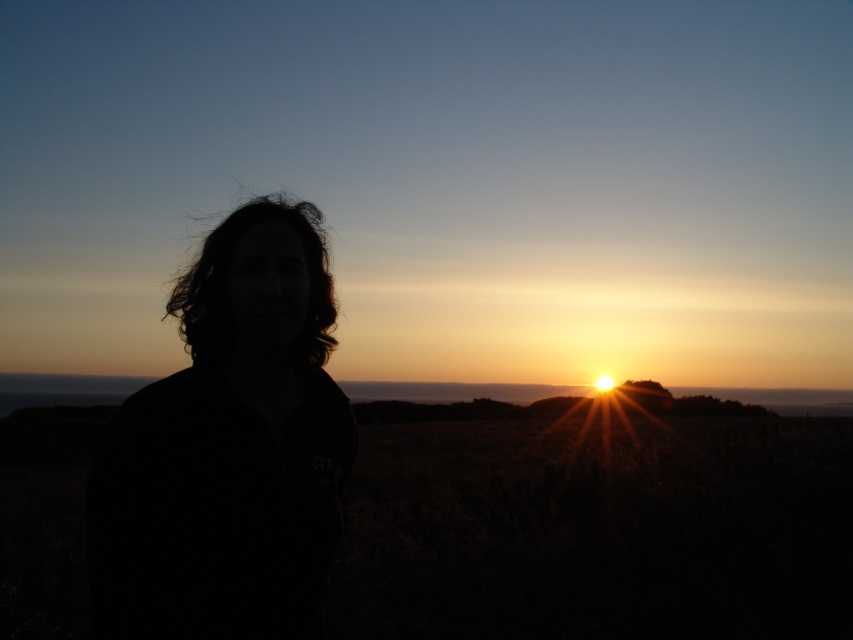
Question: Which point appears closest to the camera in this image?

Choices:
 (A) (312, 620)
 (B) (190, 269)

Answer: (A)

Question: Where is black matte hair at left located in relation to dark curly hair at center in the image?

Choices:
 (A) left
 (B) right

Answer: (B)

Question: Which object is closer to the camera taking this photo?

Choices:
 (A) black matte hair at left
 (B) dark curly hair at center

Answer: (A)

Question: Can you confirm if black matte hair at left is bigger than dark curly hair at center?

Choices:
 (A) yes
 (B) no

Answer: (B)

Question: Is black matte hair at left bigger than dark curly hair at center?

Choices:
 (A) no
 (B) yes

Answer: (A)

Question: Which point appears closest to the camera in this image?

Choices:
 (A) pyautogui.click(x=228, y=320)
 (B) pyautogui.click(x=292, y=416)

Answer: (A)